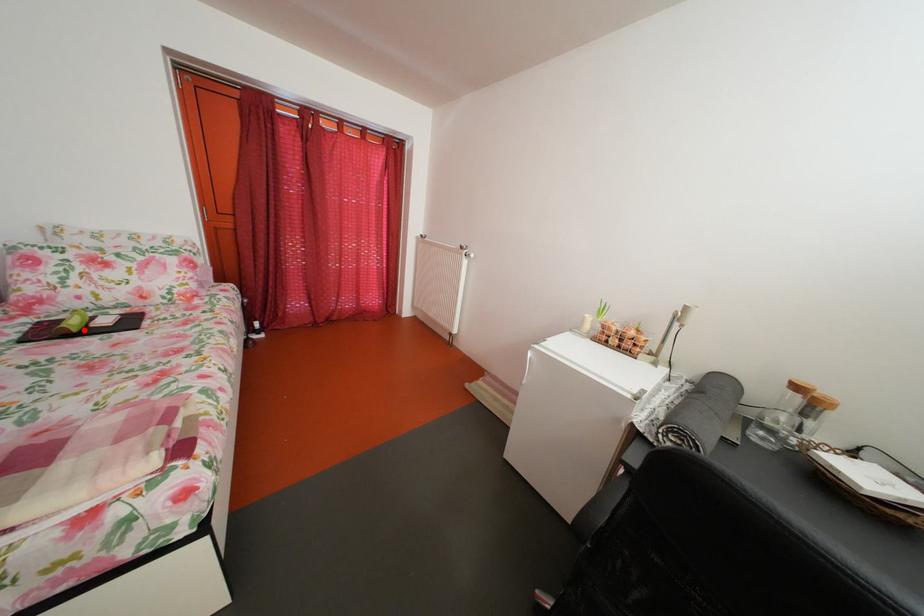
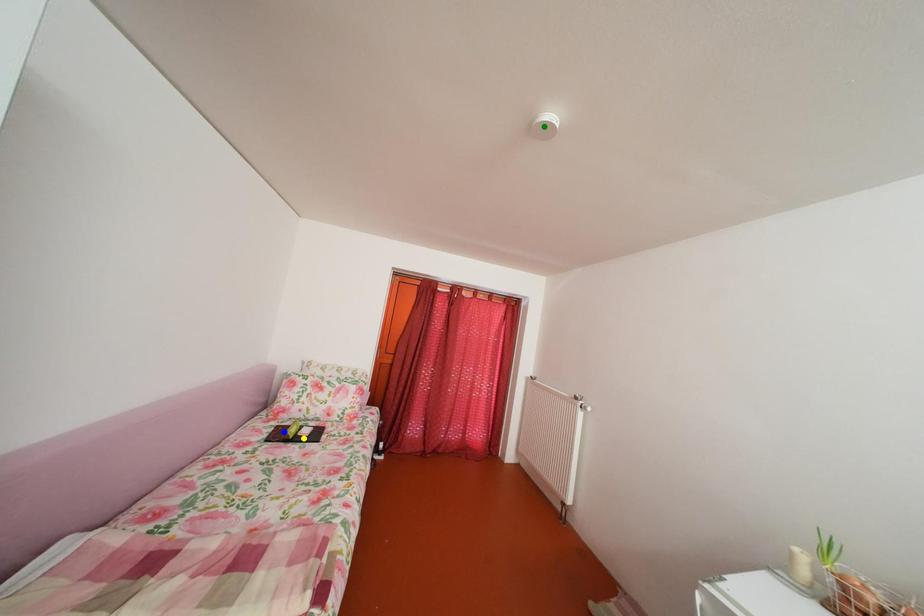
Question: I am providing you with two images of the same scene from different viewpoints. A red point is marked on the first image. You are given multiple points on the second image. Which mark in image 2 goes with the point in image 1?

Choices:
 (A) yellow point
 (B) green point
 (C) blue point

Answer: (A)